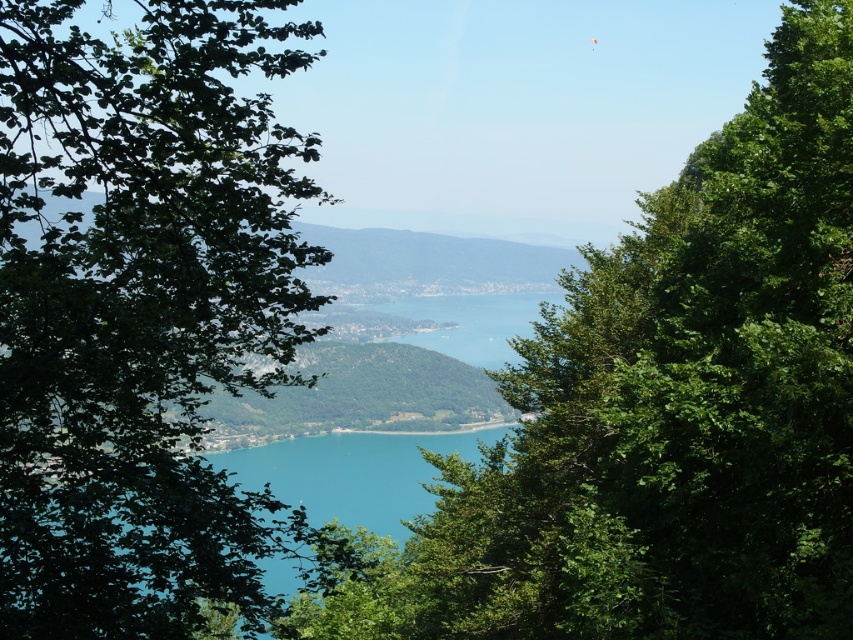
Can you confirm if green leafy tree at left is bigger than green leafy hill at center?

Yes, green leafy tree at left is bigger than green leafy hill at center.

Based on the photo, who is positioned more to the right, green leafy tree at left or green leafy hill at center?

Positioned to the right is green leafy hill at center.

Find the location of a particular element. The width and height of the screenshot is (853, 640). green leafy tree at left is located at coordinates (140, 308).

Does green leafy tree at center come behind turquoise water at center?

No.

Who is more distant from viewer, [780,444] or [316,506]?

Point [316,506]

Find the location of a particular element. The width and height of the screenshot is (853, 640). green leafy tree at center is located at coordinates click(x=665, y=410).

Describe the element at coordinates (665, 410) in the screenshot. This screenshot has height=640, width=853. I see `green leafy tree at center` at that location.

Is green leafy tree at center bigger than green leafy hill at center?

No.

Between point (660, 568) and point (392, 394), which one is positioned behind?

Positioned behind is point (392, 394).

This screenshot has height=640, width=853. Identify the location of green leafy tree at center. (x=665, y=410).